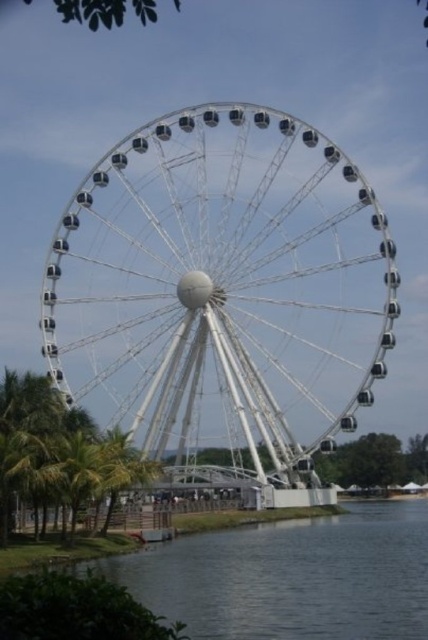
Does white metallic ferris wheel at center appear on the right side of green leafy tree at lower left?

Indeed, white metallic ferris wheel at center is positioned on the right side of green leafy tree at lower left.

Who is more distant from viewer, (112,186) or (130,460)?

Positioned behind is point (112,186).

Describe the element at coordinates (222, 296) in the screenshot. The width and height of the screenshot is (428, 640). I see `white metallic ferris wheel at center` at that location.

Where is `white metallic ferris wheel at center`? The width and height of the screenshot is (428, 640). white metallic ferris wheel at center is located at coordinates (222, 296).

Does white metallic ferris wheel at center have a larger size compared to green leafy palm tree at lower left?

Indeed, white metallic ferris wheel at center has a larger size compared to green leafy palm tree at lower left.

Can you confirm if white metallic ferris wheel at center is positioned to the left of green leafy palm tree at lower left?

In fact, white metallic ferris wheel at center is to the right of green leafy palm tree at lower left.

Which is in front, point (342, 280) or point (98, 493)?

Positioned in front is point (98, 493).

Identify the location of white metallic ferris wheel at center. This screenshot has width=428, height=640. (222, 296).

Who is more forward, (x=32, y=436) or (x=83, y=502)?

Point (x=83, y=502)

Is point (137, 460) less distant than point (101, 497)?

No, (137, 460) is further to viewer.

Looking at this image, who is more distant from viewer, (x=18, y=436) or (x=101, y=484)?

Positioned behind is point (x=18, y=436).

Locate an element on the screen. This screenshot has height=640, width=428. green leafy tree at lower left is located at coordinates (56, 451).